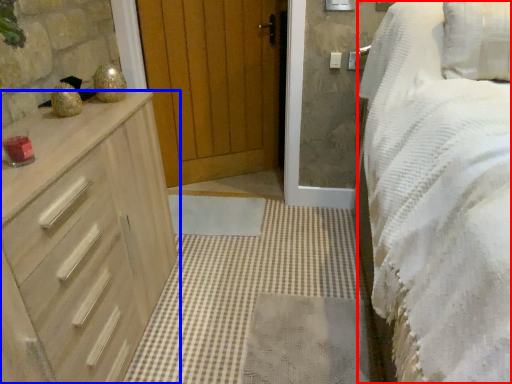
Question: Which point is closer to the camera, bed (highlighted by a red box) or chest of drawers (highlighted by a blue box)?

Choices:
 (A) bed
 (B) chest of drawers

Answer: (A)